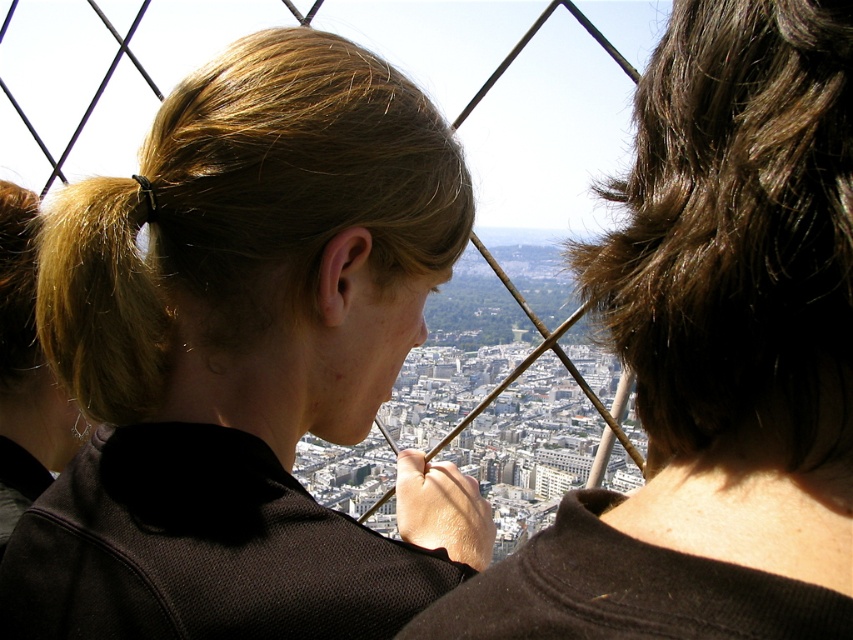
Question: Is blonde hair at center to the left of brown shiny hair at upper right from the viewer's perspective?

Choices:
 (A) no
 (B) yes

Answer: (B)

Question: Does blonde hair at center have a lesser width compared to blonde hair at left?

Choices:
 (A) yes
 (B) no

Answer: (B)

Question: Among these points, which one is nearest to the camera?

Choices:
 (A) (845, 449)
 (B) (665, 248)
 (C) (105, 282)

Answer: (A)

Question: Which point appears farthest from the camera in this image?

Choices:
 (A) (799, 250)
 (B) (90, 408)

Answer: (B)

Question: Considering the relative positions of matte black hair at upper left and brown shiny hair at upper right in the image provided, where is matte black hair at upper left located with respect to brown shiny hair at upper right?

Choices:
 (A) below
 (B) above

Answer: (A)

Question: Based on their relative distances, which object is farther from the blonde hair at left?

Choices:
 (A) matte black hair at upper left
 (B) blonde hair at center
 (C) brown shiny hair at upper right

Answer: (C)